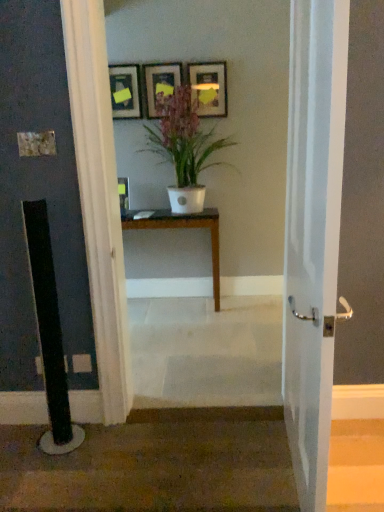
In order to face matte wooden picture frame at upper center, the second picture frame positioned from the left, should I rotate leftwards or rightwards?

A 3.973 degree turn to the left will do.

What do you see at coordinates (183, 228) in the screenshot?
I see `wooden table at center` at bounding box center [183, 228].

Identify the location of white glossy door at center. (313, 234).

Can you confirm if white matte pot at center is shorter than matte gold picture frame at upper center, acting as the first picture frame starting from the right?

No.

Could you tell me if white matte pot at center is turned towards matte gold picture frame at upper center, marked as the third picture frame in a left-to-right arrangement?

No, white matte pot at center is not oriented towards matte gold picture frame at upper center, marked as the third picture frame in a left-to-right arrangement.

Between white matte pot at center and matte gold picture frame at upper center, acting as the first picture frame starting from the right, which one has smaller width?

matte gold picture frame at upper center, acting as the first picture frame starting from the right, is thinner.

From a real-world perspective, relative to matte gold picture frame at upper center, acting as the first picture frame starting from the right, is white matte pot at center vertically above or below?

white matte pot at center is situated lower than matte gold picture frame at upper center, acting as the first picture frame starting from the right, in the real world.

Is matte wooden picture frame at upper center, the second picture frame positioned from the left, positioned far away from brown carpet at lower left?

Absolutely, matte wooden picture frame at upper center, the second picture frame positioned from the left, is distant from brown carpet at lower left.

From a real-world perspective, who is located higher, matte wooden picture frame at upper center, acting as the second picture frame starting from the right, or brown carpet at lower left?

In real-world perspective, matte wooden picture frame at upper center, acting as the second picture frame starting from the right, is above.

Consider the image. Between matte wooden picture frame at upper center, the second picture frame positioned from the left, and brown carpet at lower left, which one appears on the left side from the viewer's perspective?

Positioned to the left is matte wooden picture frame at upper center, the second picture frame positioned from the left.

Is matte wooden picture frame at upper center, acting as the second picture frame starting from the right, taller than brown carpet at lower left?

Indeed, matte wooden picture frame at upper center, acting as the second picture frame starting from the right, has a greater height compared to brown carpet at lower left.

Which is more to the right, matte black picture frame at upper center, positioned as the 3th picture frame in right-to-left order, or matte wooden picture frame at upper center, the second picture frame positioned from the left?

From the viewer's perspective, matte wooden picture frame at upper center, the second picture frame positioned from the left, appears more on the right side.

You are a GUI agent. You are given a task and a screenshot of the screen. Output one action in this format:
    pyautogui.click(x=<x>, y=<y>)
    Task: Click on the 1st picture frame counting from the right of the matte black picture frame at upper center, positioned as the 3th picture frame in right-to-left order
    
    Given the screenshot: What is the action you would take?
    pyautogui.click(x=160, y=85)

Is matte black picture frame at upper center, positioned as the 3th picture frame in right-to-left order, turned away from matte wooden picture frame at upper center, acting as the second picture frame starting from the right?

No, matte black picture frame at upper center, positioned as the 3th picture frame in right-to-left order, is not facing away from matte wooden picture frame at upper center, acting as the second picture frame starting from the right.

Based on the photo, is matte black picture frame at upper center, positioned as the 3th picture frame in right-to-left order, positioned far away from matte wooden picture frame at upper center, the second picture frame positioned from the left?

That's not correct — matte black picture frame at upper center, positioned as the 3th picture frame in right-to-left order, is a little close to matte wooden picture frame at upper center, the second picture frame positioned from the left.

Which is behind, point (195, 214) or point (67, 501)?

The point (195, 214) is more distant.

Can you confirm if wooden table at center is shorter than brown carpet at lower left?

No, wooden table at center is not shorter than brown carpet at lower left.

How many degrees apart are the facing directions of wooden table at center and brown carpet at lower left?

The facing directions of wooden table at center and brown carpet at lower left are 0.8 degrees apart.

Is white glossy door at center completely or partially outside of matte gold picture frame at upper center, acting as the first picture frame starting from the right?

white glossy door at center lies outside matte gold picture frame at upper center, acting as the first picture frame starting from the right,'s area.

Is white glossy door at center oriented towards matte gold picture frame at upper center, marked as the third picture frame in a left-to-right arrangement?

No, white glossy door at center is not facing towards matte gold picture frame at upper center, marked as the third picture frame in a left-to-right arrangement.

Would you say white glossy door at center is to the left or to the right of matte gold picture frame at upper center, acting as the first picture frame starting from the right, in the picture?

white glossy door at center is to the right of matte gold picture frame at upper center, acting as the first picture frame starting from the right.

Which of these two, white glossy door at center or matte gold picture frame at upper center, marked as the third picture frame in a left-to-right arrangement, is wider?

white glossy door at center is wider.

The image size is (384, 512). I want to click on table that is on the right side of matte wooden picture frame at upper center, acting as the second picture frame starting from the right, so click(183, 228).

From the image's perspective, relative to wooden table at center, is matte wooden picture frame at upper center, the second picture frame positioned from the left, above or below?

Based on their image positions, matte wooden picture frame at upper center, the second picture frame positioned from the left, is located above wooden table at center.

Does matte wooden picture frame at upper center, acting as the second picture frame starting from the right, have a greater height compared to wooden table at center?

No, matte wooden picture frame at upper center, acting as the second picture frame starting from the right, is not taller than wooden table at center.

From the image's perspective, is matte gold picture frame at upper center, acting as the first picture frame starting from the right, located above or below white glossy door at center?

Clearly, from the image's perspective, matte gold picture frame at upper center, acting as the first picture frame starting from the right, is above white glossy door at center.

How distant is matte gold picture frame at upper center, acting as the first picture frame starting from the right, from white glossy door at center?

They are 1.99 meters apart.

Does matte gold picture frame at upper center, acting as the first picture frame starting from the right, have a greater width compared to white glossy door at center?

In fact, matte gold picture frame at upper center, acting as the first picture frame starting from the right, might be narrower than white glossy door at center.

Which is less distant, (207, 64) or (329, 56)?

Point (207, 64) is farther from the camera than point (329, 56).

The image size is (384, 512). In the image, there is a matte gold picture frame at upper center, marked as the third picture frame in a left-to-right arrangement. In order to click on houseplant below it (from a real-world perspective) in this screenshot , I will do `click(183, 148)`.

At what (x,y) coordinates should I click in order to perform the action: click on picture frame that is the 2nd object above the brown carpet at lower left (from a real-world perspective). Please return your answer as a coordinate pair (x, y). The image size is (384, 512). Looking at the image, I should click on (160, 85).

When comparing their distances from brown carpet at lower left, does wooden table at center or matte black picture frame at upper center, the first picture frame positioned from the left, seem closer?

Based on the image, wooden table at center appears to be nearer to brown carpet at lower left.

Estimate the real-world distances between objects in this image. Which object is closer to white glossy door at center, white matte pot at center or matte gold picture frame at upper center, marked as the third picture frame in a left-to-right arrangement?

Based on the image, white matte pot at center appears to be nearer to white glossy door at center.

Based on the photo, looking at the image, which one is located closer to brown carpet at lower left, matte black picture frame at upper center, the first picture frame positioned from the left, or white glossy door at center?

white glossy door at center is positioned closer to the anchor brown carpet at lower left.

From the image, which object appears to be farther from wooden table at center, brown carpet at lower left or white matte pot at center?

The object further to wooden table at center is brown carpet at lower left.

Considering their positions, is brown carpet at lower left positioned further to matte gold picture frame at upper center, acting as the first picture frame starting from the right, than white glossy door at center?

The object further to matte gold picture frame at upper center, acting as the first picture frame starting from the right, is brown carpet at lower left.

From the image, which object appears to be farther from white matte pot at center, white glossy door at center or wooden table at center?

white glossy door at center is positioned further to the anchor white matte pot at center.

From the image, which object appears to be farther from white glossy door at center, brown carpet at lower left or white matte pot at center?

white matte pot at center.

When comparing their distances from brown carpet at lower left, does white glossy door at center or white matte pot at center seem further?

white matte pot at center lies further to brown carpet at lower left than the other object.

Find the location of a particular element. The image size is (384, 512). houseplant between matte wooden picture frame at upper center, the second picture frame positioned from the left, and brown carpet at lower left from top to bottom is located at coordinates (183, 148).

The image size is (384, 512). I want to click on houseplant between white glossy door at center and matte wooden picture frame at upper center, acting as the second picture frame starting from the right, in the front-back direction, so click(183, 148).

Where is `table between matte wooden picture frame at upper center, the second picture frame positioned from the left, and brown carpet at lower left from top to bottom`? table between matte wooden picture frame at upper center, the second picture frame positioned from the left, and brown carpet at lower left from top to bottom is located at coordinates (183, 228).

Find the location of `picture frame between matte wooden picture frame at upper center, the second picture frame positioned from the left, and white matte pot at center vertically`. picture frame between matte wooden picture frame at upper center, the second picture frame positioned from the left, and white matte pot at center vertically is located at coordinates (125, 91).